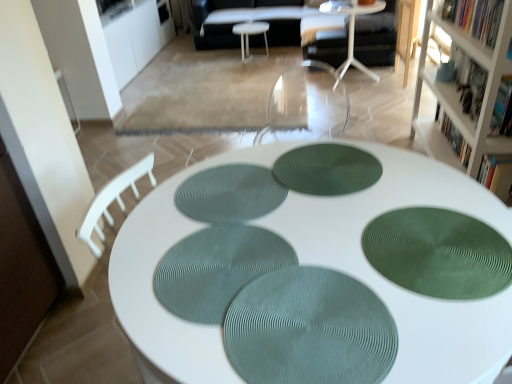
Find the location of a particular element. The image size is (512, 384). vacant space that is in between teal textured placemat at center, the second mat positioned from the left, and green textured placemat at center is located at coordinates (304, 258).